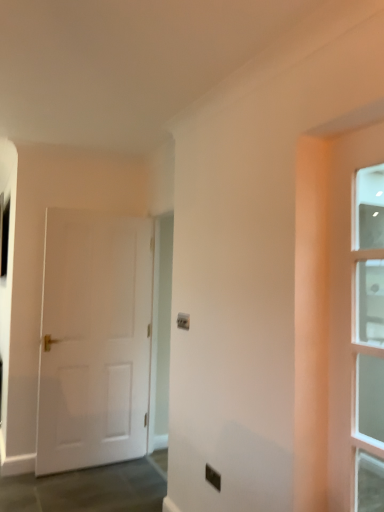
Question: Does black plastic electric outlet at center have a greater height compared to clear glass door at right, the 2th door from the back?

Choices:
 (A) no
 (B) yes

Answer: (A)

Question: Is black plastic electric outlet at center turned away from clear glass door at right, arranged as the first door when viewed from the front?

Choices:
 (A) yes
 (B) no

Answer: (B)

Question: Is black plastic electric outlet at center next to clear glass door at right, arranged as the first door when viewed from the front, and touching it?

Choices:
 (A) yes
 (B) no

Answer: (B)

Question: Is black plastic electric outlet at center shorter than clear glass door at right, the 2th door viewed from the left?

Choices:
 (A) yes
 (B) no

Answer: (A)

Question: Is black plastic electric outlet at center not within clear glass door at right, the 2th door viewed from the left?

Choices:
 (A) yes
 (B) no

Answer: (A)

Question: Visually, is black plastic electric outlet at center positioned to the left or to the right of clear glass door at right, arranged as the first door when viewed from the front?

Choices:
 (A) left
 (B) right

Answer: (A)

Question: From the image's perspective, is black plastic electric outlet at center located above or below clear glass door at right, the 1th door in the right-to-left sequence?

Choices:
 (A) above
 (B) below

Answer: (B)

Question: Is black plastic electric outlet at center situated inside clear glass door at right, the 2th door from the back, or outside?

Choices:
 (A) outside
 (B) inside

Answer: (A)

Question: Is point (208, 474) positioned closer to the camera than point (345, 170)?

Choices:
 (A) farther
 (B) closer

Answer: (A)

Question: In the image, is clear glass door at right, the 2th door viewed from the left, on the left side or the right side of black plastic electric outlet at center?

Choices:
 (A) right
 (B) left

Answer: (A)

Question: Based on their sizes in the image, would you say clear glass door at right, the 1th door in the right-to-left sequence, is bigger or smaller than black plastic electric outlet at center?

Choices:
 (A) big
 (B) small

Answer: (A)

Question: From their relative heights in the image, would you say clear glass door at right, arranged as the first door when viewed from the front, is taller or shorter than black plastic electric outlet at center?

Choices:
 (A) tall
 (B) short

Answer: (A)

Question: From a real-world perspective, relative to black plastic electric outlet at center, is clear glass door at right, the 2th door from the back, vertically above or below?

Choices:
 (A) below
 (B) above

Answer: (B)

Question: Is white matte door at left, positioned as the 1th door in back-to-front order, to the left or to the right of black plastic electric outlet at center in the image?

Choices:
 (A) right
 (B) left

Answer: (B)

Question: From the image's perspective, is white matte door at left, the second door in the right-to-left sequence, above or below black plastic electric outlet at center?

Choices:
 (A) below
 (B) above

Answer: (B)